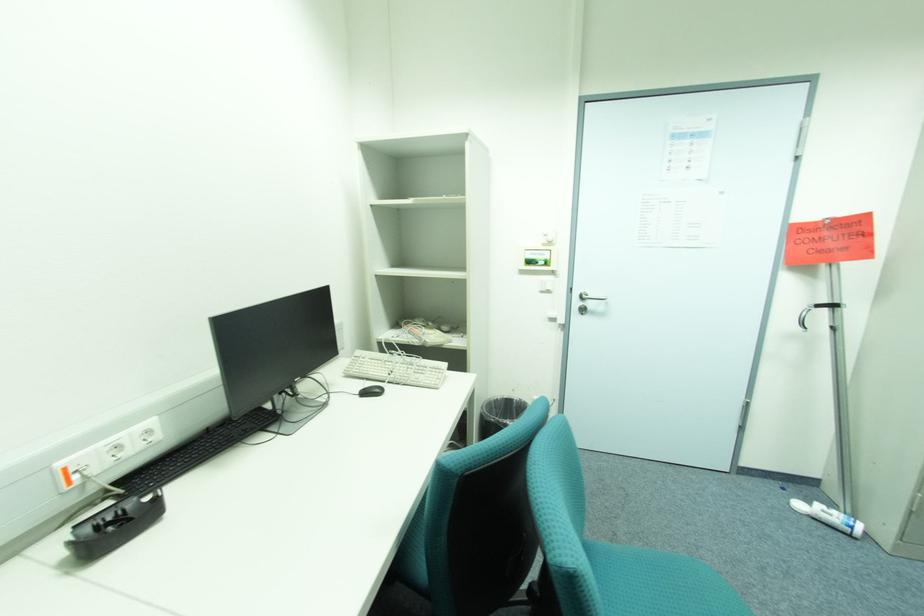
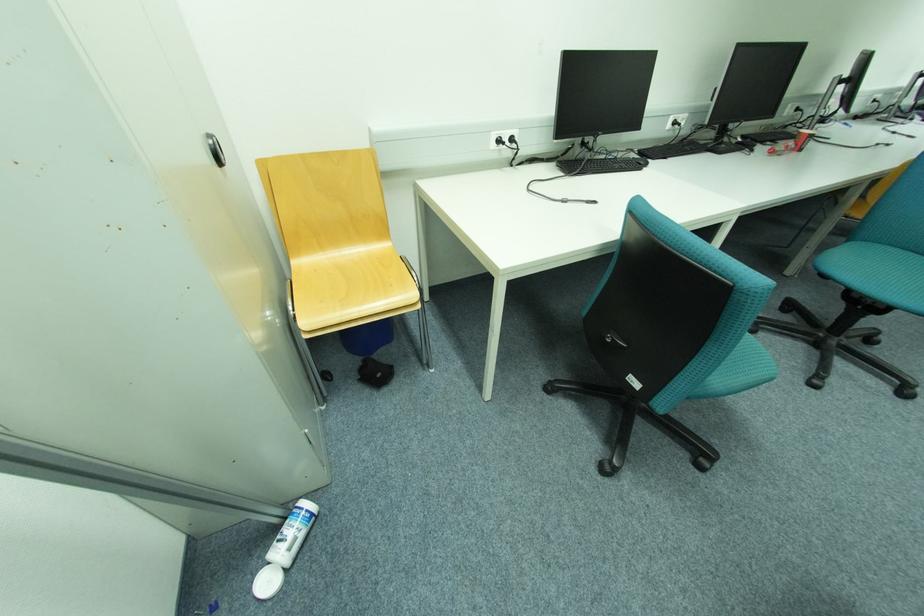
The point at (807, 506) is marked in the first image. Where is the corresponding point in the second image?

(274, 584)